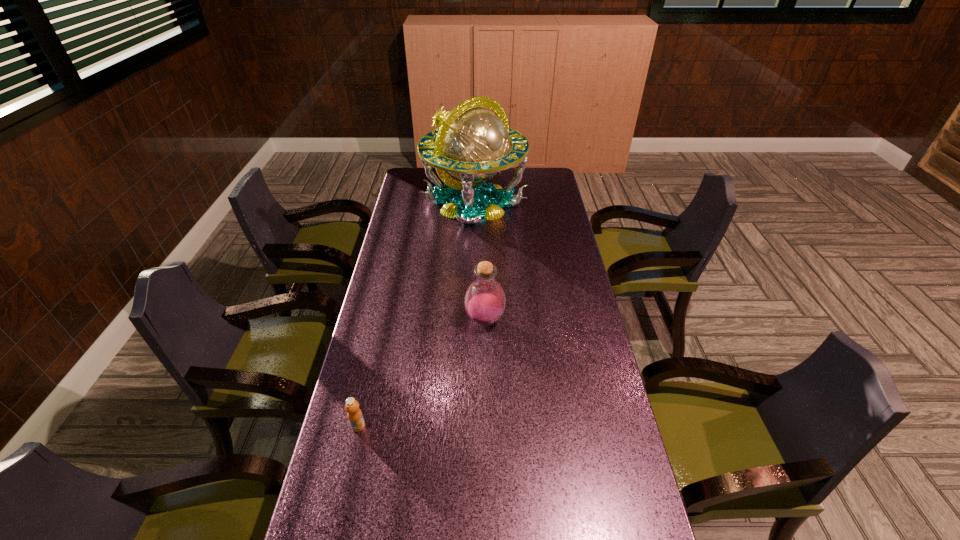
I want to click on vacant space that is in between the leftmost object and the globe, so click(x=417, y=314).

Find the location of a particular element. The height and width of the screenshot is (540, 960). empty location between the nearest object and the bottle is located at coordinates (421, 373).

Locate an element on the screen. object that is the second closest to the globe is located at coordinates (354, 413).

Find the location of `object that is the closest to the nearest object`. object that is the closest to the nearest object is located at coordinates (484, 301).